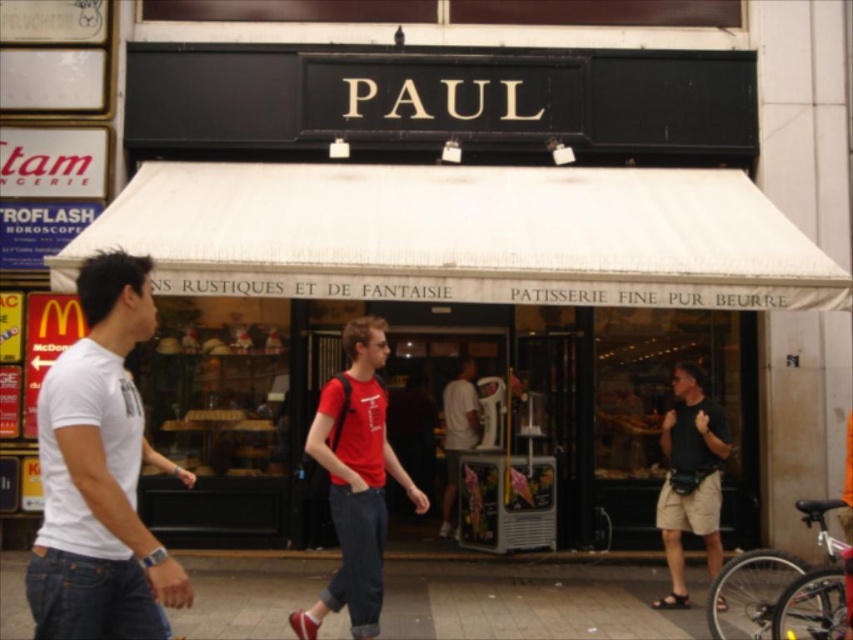
Which of these two, red cotton t-shirt at center or white t-shirt at center, stands taller?

red cotton t-shirt at center

Can you confirm if red cotton t-shirt at center is taller than white t-shirt at center?

Result: Yes, red cotton t-shirt at center is taller than white t-shirt at center.

Where is `red cotton t-shirt at center`? Image resolution: width=853 pixels, height=640 pixels. red cotton t-shirt at center is located at coordinates (357, 481).

Image resolution: width=853 pixels, height=640 pixels. I want to click on red cotton t-shirt at center, so click(357, 481).

This screenshot has width=853, height=640. I want to click on red cotton t-shirt at center, so [x=357, y=481].

Does point (589, 614) come farther from viewer compared to point (695, 410)?

No, (589, 614) is in front of (695, 410).

Image resolution: width=853 pixels, height=640 pixels. What are the coordinates of `smooth concrete pavement at lower center` in the screenshot? It's located at (534, 600).